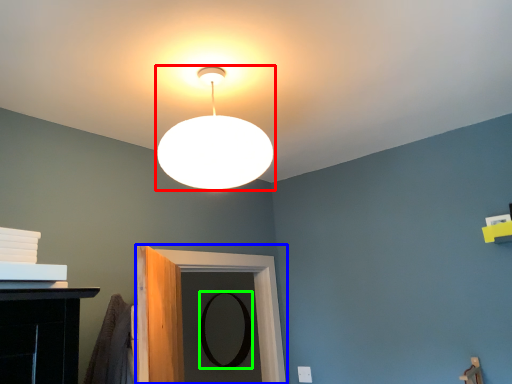
Question: Which object is positioned farthest from lamp (highlighted by a red box)? Select from door (highlighted by a blue box) and mirror (highlighted by a green box).

Choices:
 (A) door
 (B) mirror

Answer: (B)